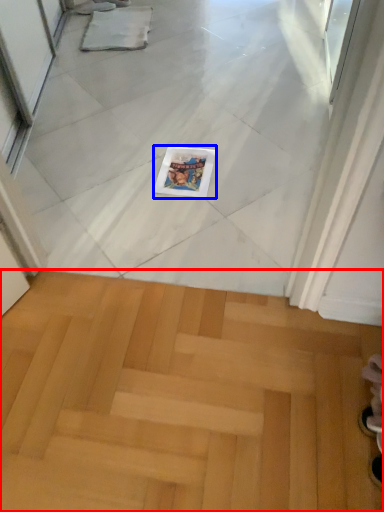
Question: Which point is closer to the camera, stairwell (highlighted by a red box) or magazine (highlighted by a blue box)?

Choices:
 (A) stairwell
 (B) magazine

Answer: (A)